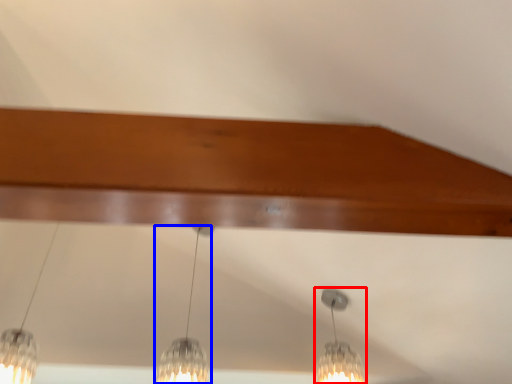
Question: Which object appears closest to the camera in this image, lamp (highlighted by a red box) or lamp (highlighted by a blue box)?

Choices:
 (A) lamp
 (B) lamp

Answer: (B)